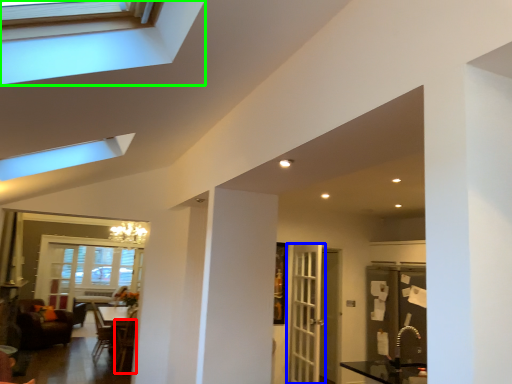
Question: Which is farther away from armchair (highlighted by a red box)? door (highlighted by a blue box) or window (highlighted by a green box)?

Choices:
 (A) door
 (B) window

Answer: (B)